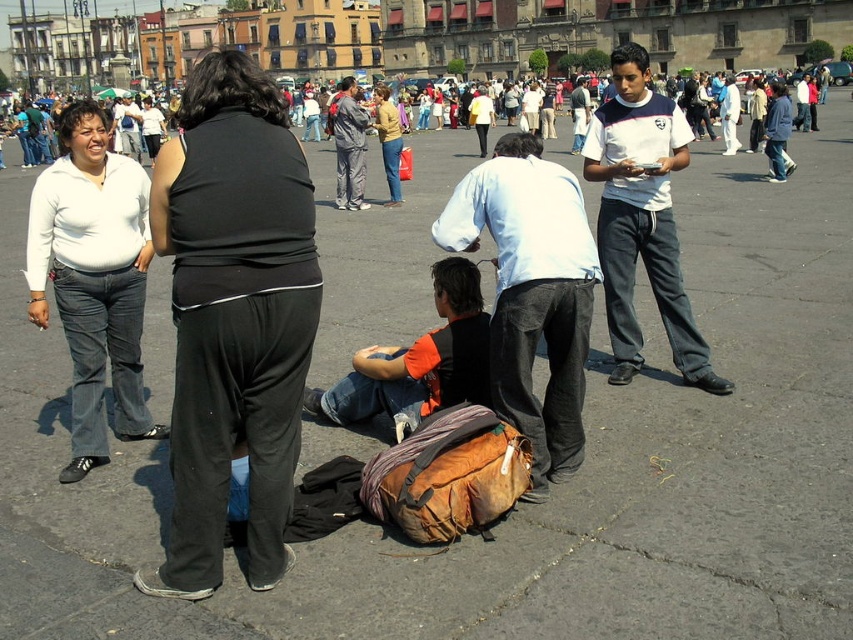
Between light blue shirt at center and white matte shirt at center, which one has more height?

With more height is light blue shirt at center.

Image resolution: width=853 pixels, height=640 pixels. What do you see at coordinates (531, 292) in the screenshot?
I see `light blue shirt at center` at bounding box center [531, 292].

Find the location of a particular element. This screenshot has width=853, height=640. light blue shirt at center is located at coordinates (531, 292).

Which is below, gray fabric pants at center or matte yellow sweater at center?

matte yellow sweater at center is below.

Which is more to the right, gray fabric pants at center or matte yellow sweater at center?

matte yellow sweater at center

Which is behind, point (355, 104) or point (387, 108)?

Positioned behind is point (387, 108).

Identify the location of gray fabric pants at center. The image size is (853, 640). (347, 145).

Does black fabric pants at center have a greater height compared to matte black shirt at center?

In fact, black fabric pants at center may be shorter than matte black shirt at center.

Between black fabric pants at center and matte black shirt at center, which one has less height?

black fabric pants at center is shorter.

Measure the distance between point (202,173) and camera.

Point (202,173) and camera are 35.17 meters apart from each other.

Where is `black fabric pants at center`? The height and width of the screenshot is (640, 853). black fabric pants at center is located at coordinates (233, 317).